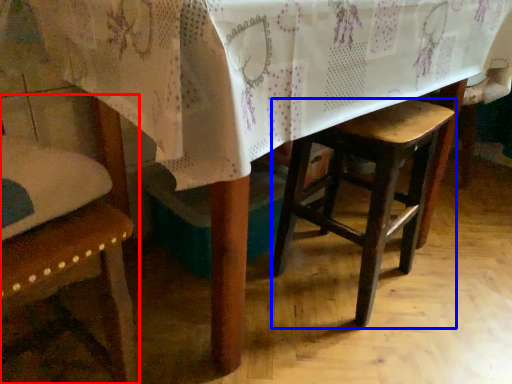
Question: Which of the following is the closest to the observer, chair (highlighted by a red box) or stool (highlighted by a blue box)?

Choices:
 (A) chair
 (B) stool

Answer: (A)